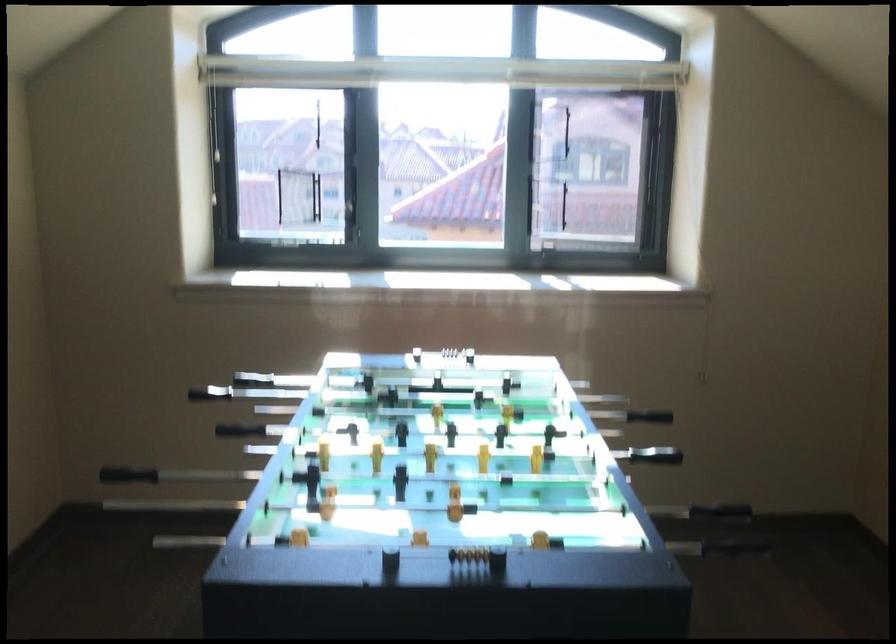
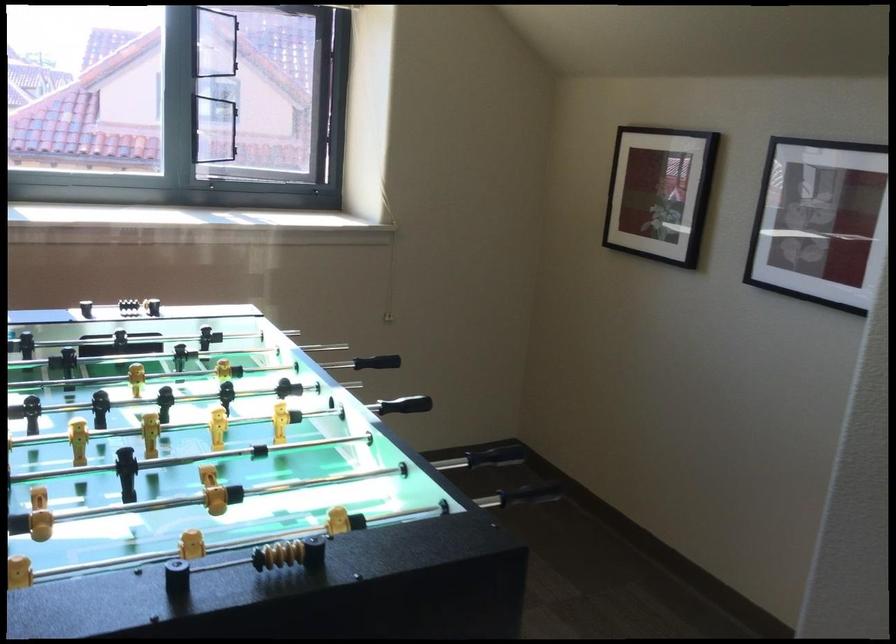
What movement of the cameraman would produce the second image?

The movement direction of the cameraman is left, forward.